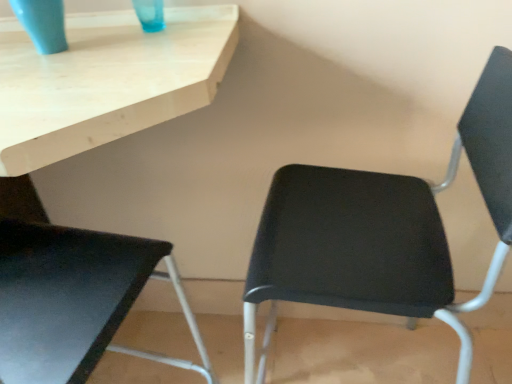
Question: Is matte blue glass at upper left inside or outside of black plastic chair at center, positioned as the 2th chair in left-to-right order?

Choices:
 (A) outside
 (B) inside

Answer: (A)

Question: From a real-world perspective, is matte blue glass at upper left positioned above or below black plastic chair at center, which is the first chair from right to left?

Choices:
 (A) below
 (B) above

Answer: (B)

Question: Estimate the real-world distances between objects in this image. Which object is farther from the black plastic chair at center, positioned as the 2th chair in left-to-right order?

Choices:
 (A) matte blue glass at upper left
 (B) matte black chair at lower left, which is counted as the first chair, starting from the left

Answer: (A)

Question: Estimate the real-world distances between objects in this image. Which object is closer to the black plastic chair at center, which is the first chair from right to left?

Choices:
 (A) matte blue glass at upper left
 (B) matte black chair at lower left, which is counted as the first chair, starting from the left

Answer: (B)